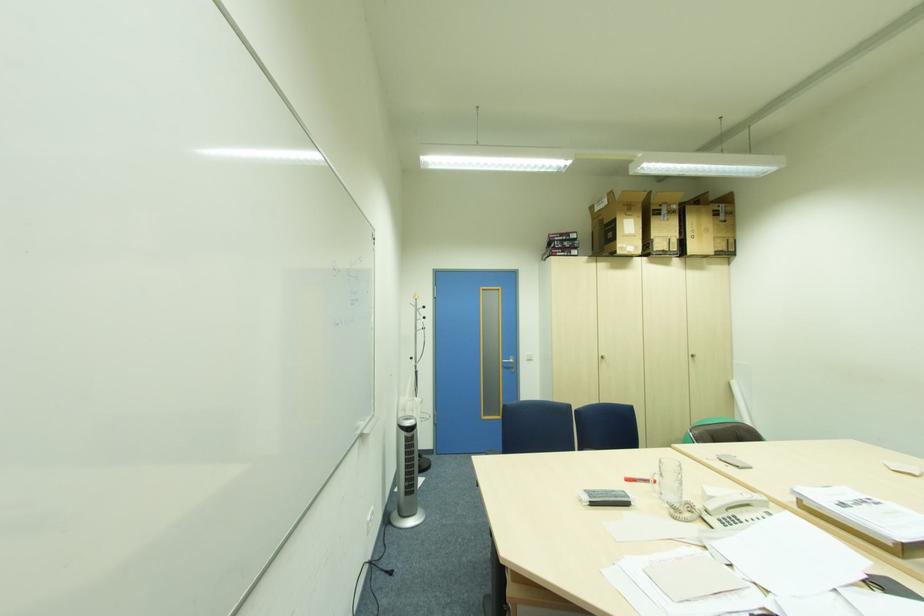
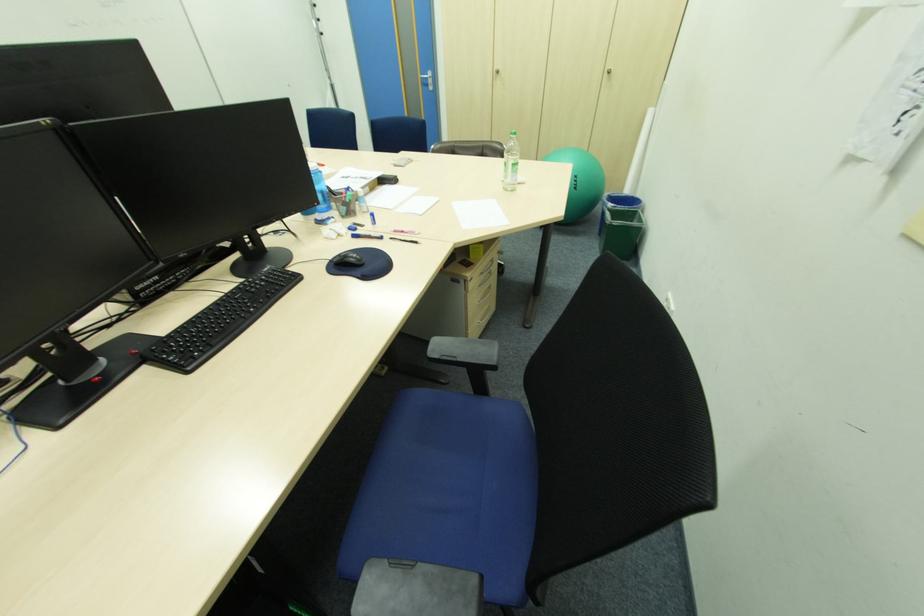
In the second image, find the point that corresponds to (699,361) in the first image.

(615, 79)